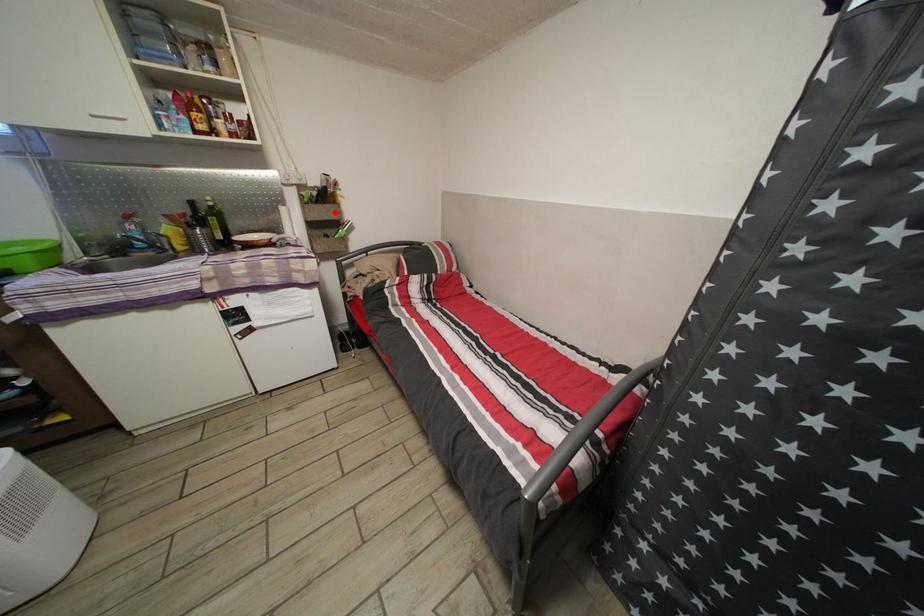
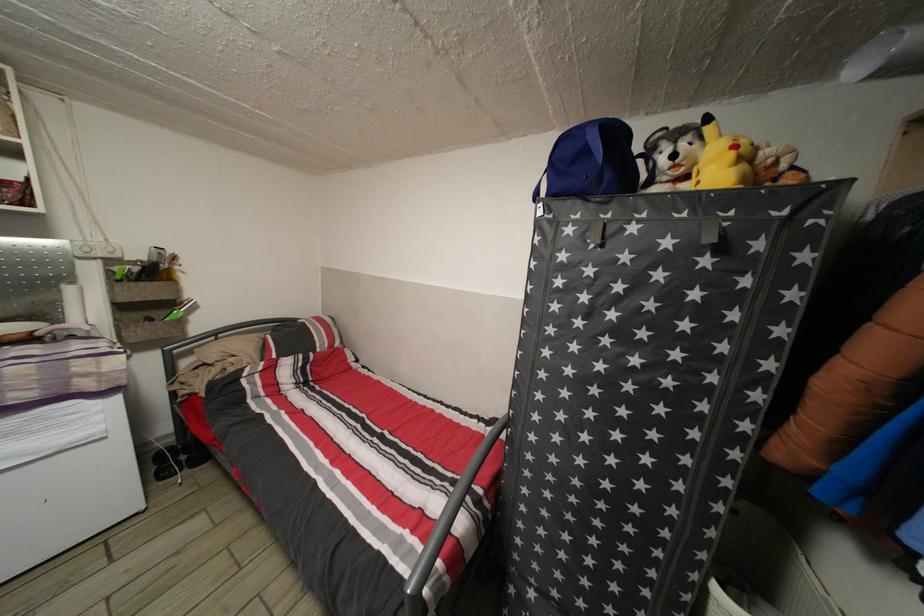
Question: I am providing you with two images of the same scene from different viewpoints. Image1 has a red point marked. In image2, the corresponding 3D location appears at what relative position? Reply with the corresponding letter.

Choices:
 (A) Closer
 (B) Farther

Answer: (B)